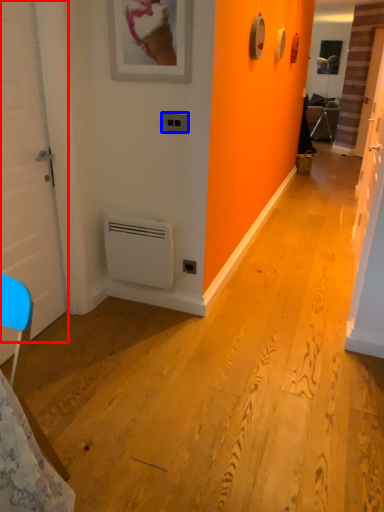
Question: Which object is further to the camera taking this photo, door (highlighted by a red box) or light switch (highlighted by a blue box)?

Choices:
 (A) door
 (B) light switch

Answer: (B)